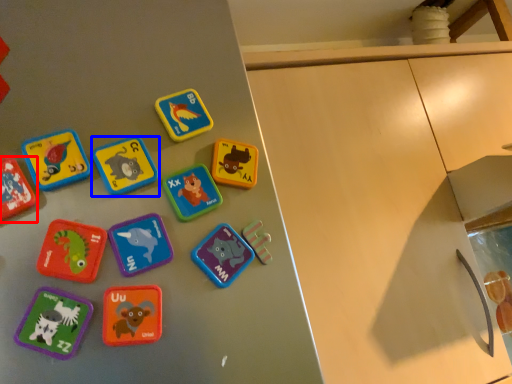
Question: Which point is closer to the camera, toy (highlighted by a red box) or toy (highlighted by a blue box)?

Choices:
 (A) toy
 (B) toy

Answer: (A)